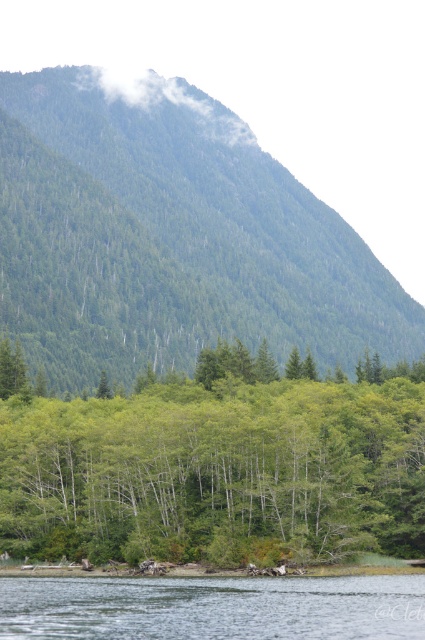
Does green forested mountain at upper center have a lesser width compared to clear water at lower center?

No, green forested mountain at upper center is not thinner than clear water at lower center.

This screenshot has width=425, height=640. Identify the location of green forested mountain at upper center. (170, 237).

Is point (104, 248) positioned after point (246, 593)?

Yes.

The height and width of the screenshot is (640, 425). Identify the location of green forested mountain at upper center. (170, 237).

Which is above, green matte trees at center or clear water at lower center?

green matte trees at center is above.

Is green matte trees at center bigger than clear water at lower center?

Yes.

This screenshot has height=640, width=425. Describe the element at coordinates (218, 467) in the screenshot. I see `green matte trees at center` at that location.

I want to click on green matte trees at center, so click(x=218, y=467).

Can you confirm if green forested mountain at upper center is bigger than green matte trees at center?

Correct, green forested mountain at upper center is larger in size than green matte trees at center.

Does green forested mountain at upper center appear under green matte trees at center?

Incorrect, green forested mountain at upper center is not positioned below green matte trees at center.

Which is in front, point (326, 225) or point (277, 387)?

Point (277, 387) is in front.

In order to click on green forested mountain at upper center in this screenshot , I will do `click(170, 237)`.